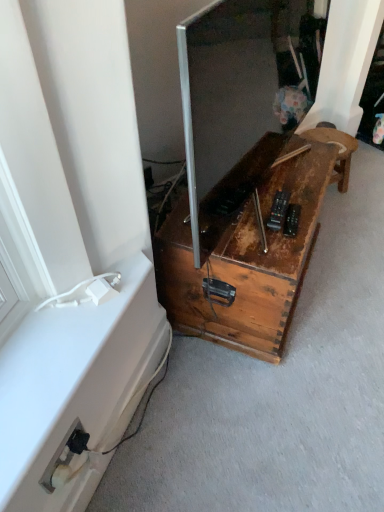
Question: Would you say rusty wood stool at center, placed as the second furniture when sorted from left to right, is to the left or to the right of rusty wood trunk at lower right, marked as the 2th furniture in a right-to-left arrangement, in the picture?

Choices:
 (A) left
 (B) right

Answer: (B)

Question: Is point (349, 142) closer or farther from the camera than point (228, 243)?

Choices:
 (A) farther
 (B) closer

Answer: (A)

Question: Estimate the real-world distances between objects in this image. Which object is closer to the rusty wood trunk at lower right, marked as the 2th furniture in a right-to-left arrangement?

Choices:
 (A) white plastic electrical outlet at lower left
 (B) rusty wood stool at center, placed as the second furniture when sorted from left to right
 (C) metallic silver screen at center

Answer: (C)

Question: Which object is the closest to the metallic silver screen at center?

Choices:
 (A) rusty wood stool at center, which is counted as the first furniture, starting from the right
 (B) white plastic electrical outlet at lower left
 (C) rusty wood trunk at lower right, the 1th furniture in the left-to-right sequence

Answer: (C)